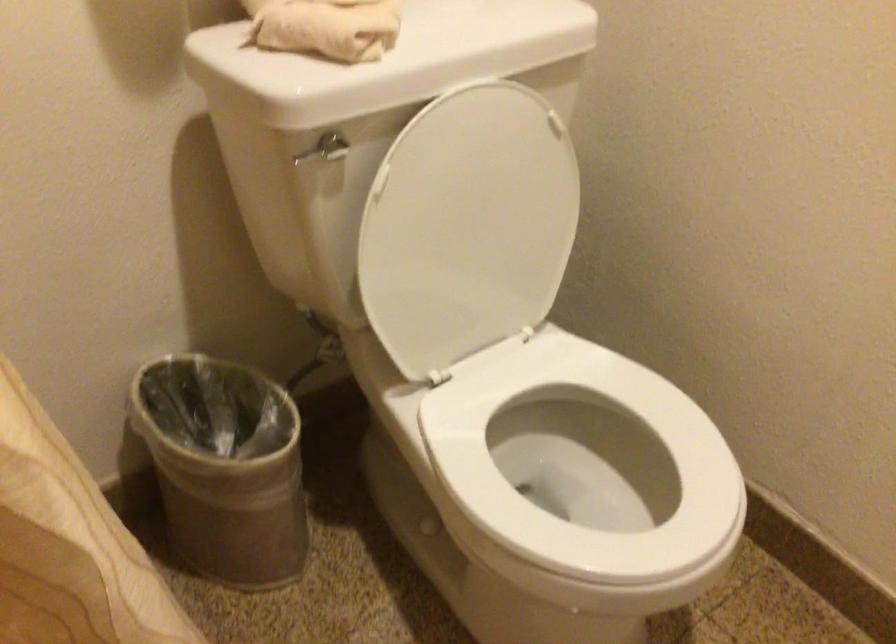
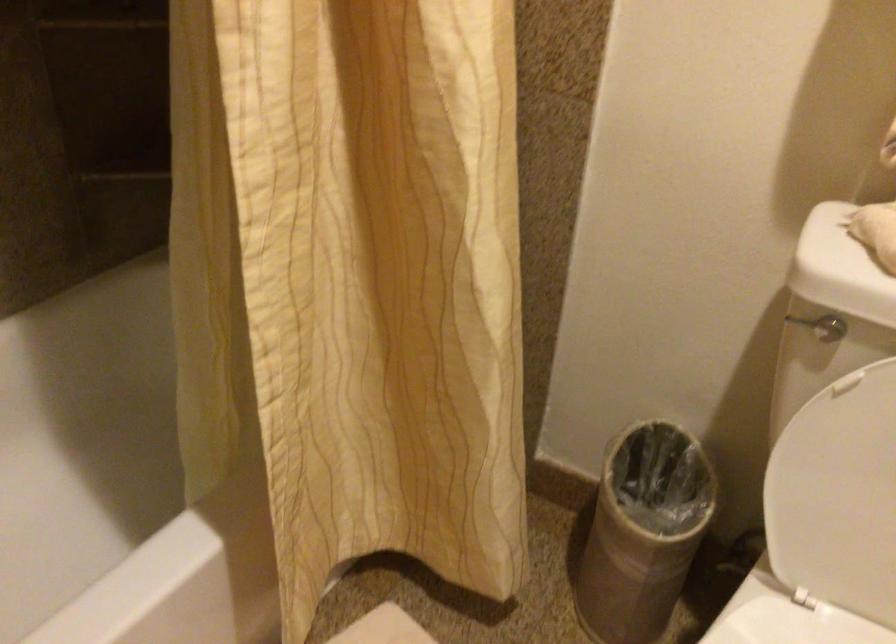
Question: Based on the continuous images, in which direction is the camera rotating? Reply with the corresponding letter.

Choices:
 (A) Left
 (B) Right
 (C) Up
 (D) Down

Answer: (A)